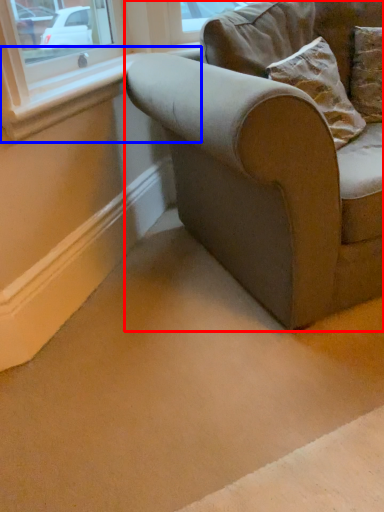
Question: Which point is further to the camera, studio couch (highlighted by a red box) or window sill (highlighted by a blue box)?

Choices:
 (A) studio couch
 (B) window sill

Answer: (B)